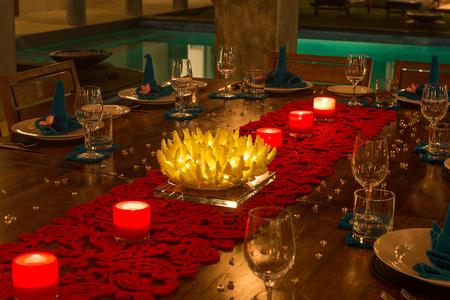
The height and width of the screenshot is (300, 450). What are the coordinates of `chair` in the screenshot? It's located at (68, 76).